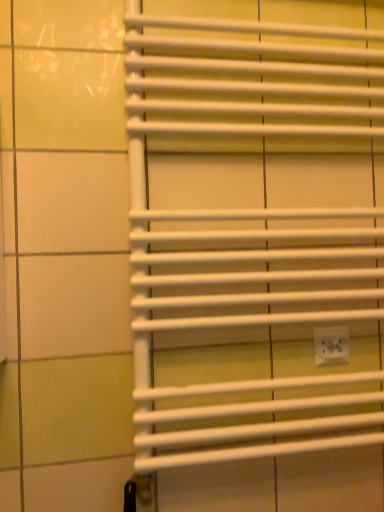
Locate an element on the screen. white plastic electric outlet at lower right is located at coordinates [331, 345].

What do you see at coordinates (331, 345) in the screenshot? I see `white plastic electric outlet at lower right` at bounding box center [331, 345].

Where is `white matte towel rack at center`? Image resolution: width=384 pixels, height=512 pixels. white matte towel rack at center is located at coordinates (257, 225).

This screenshot has height=512, width=384. What do you see at coordinates (257, 225) in the screenshot?
I see `white matte towel rack at center` at bounding box center [257, 225].

This screenshot has height=512, width=384. In order to click on white plastic electric outlet at lower right in this screenshot , I will do `click(331, 345)`.

Is white plastic electric outlet at lower right at the left side of white matte towel rack at center?

No.

Considering their positions, is white plastic electric outlet at lower right located in front of or behind white matte towel rack at center?

A: Visually, white plastic electric outlet at lower right is located behind white matte towel rack at center.

Is point (339, 359) positioned in front of point (247, 185)?

No.

From the image's perspective, between white plastic electric outlet at lower right and white matte towel rack at center, which one is located above?

white matte towel rack at center, from the image's perspective.

From a real-world perspective, is white plastic electric outlet at lower right positioned over white matte towel rack at center based on gravity?

Actually, white plastic electric outlet at lower right is physically below white matte towel rack at center in the real world.

Which object is thinner, white plastic electric outlet at lower right or white matte towel rack at center?

Thinner between the two is white plastic electric outlet at lower right.

Does white plastic electric outlet at lower right have a lesser height compared to white matte towel rack at center?

Yes, white plastic electric outlet at lower right is shorter than white matte towel rack at center.

Considering the relative sizes of white plastic electric outlet at lower right and white matte towel rack at center in the image provided, is white plastic electric outlet at lower right bigger than white matte towel rack at center?

Incorrect, white plastic electric outlet at lower right is not larger than white matte towel rack at center.

Choose the correct answer: Is white plastic electric outlet at lower right inside white matte towel rack at center or outside it?

white plastic electric outlet at lower right is located inside white matte towel rack at center.

Is white plastic electric outlet at lower right placed right next to white matte towel rack at center?

white plastic electric outlet at lower right is not next to white matte towel rack at center, and they're not touching.

Is white plastic electric outlet at lower right turned away from white matte towel rack at center?

Correct, white plastic electric outlet at lower right is looking away from white matte towel rack at center.

How many degrees apart are the facing directions of white plastic electric outlet at lower right and white matte towel rack at center?

0.000303 degrees separate the facing orientations of white plastic electric outlet at lower right and white matte towel rack at center.

What are the coordinates of `electric outlet on the right of white matte towel rack at center` in the screenshot? It's located at (331, 345).

Is white matte towel rack at center to the right of white plastic electric outlet at lower right from the viewer's perspective?

Incorrect, white matte towel rack at center is not on the right side of white plastic electric outlet at lower right.

Does white matte towel rack at center come in front of white plastic electric outlet at lower right?

Yes, white matte towel rack at center is in front of white plastic electric outlet at lower right.

Is point (368, 156) positioned in front of point (338, 360)?

No.

From the image's perspective, is white matte towel rack at center positioned above or below white plastic electric outlet at lower right?

white matte towel rack at center is above white plastic electric outlet at lower right.

From a real-world perspective, between white matte towel rack at center and white plastic electric outlet at lower right, who is vertically higher?

white matte towel rack at center is physically above.

Which of these two, white matte towel rack at center or white plastic electric outlet at lower right, is thinner?

With smaller width is white plastic electric outlet at lower right.

Who is shorter, white matte towel rack at center or white plastic electric outlet at lower right?

white plastic electric outlet at lower right.

Can you confirm if white matte towel rack at center is bigger than white plastic electric outlet at lower right?

Indeed, white matte towel rack at center has a larger size compared to white plastic electric outlet at lower right.

Is white matte towel rack at center positioned beyond the bounds of white plastic electric outlet at lower right?

white matte towel rack at center is positioned outside white plastic electric outlet at lower right.

Is there a large distance between white matte towel rack at center and white plastic electric outlet at lower right?

white matte towel rack at center is actually quite close to white plastic electric outlet at lower right.

Is white matte towel rack at center oriented away from white plastic electric outlet at lower right?

Yes, white plastic electric outlet at lower right is at the back of white matte towel rack at center.

How many degrees apart are the facing directions of white matte towel rack at center and white plastic electric outlet at lower right?

The angle between the facing direction of white matte towel rack at center and the facing direction of white plastic electric outlet at lower right is 0.000303 degrees.

I want to click on electric outlet that is behind the white matte towel rack at center, so click(x=331, y=345).

At what (x,y) coordinates should I click in order to perform the action: click on electric outlet lying below the white matte towel rack at center (from the image's perspective). Please return your answer as a coordinate pair (x, y). The width and height of the screenshot is (384, 512). Looking at the image, I should click on (331, 345).

This screenshot has width=384, height=512. In order to click on electric outlet on the right of the white matte towel rack at center in this screenshot , I will do `click(331, 345)`.